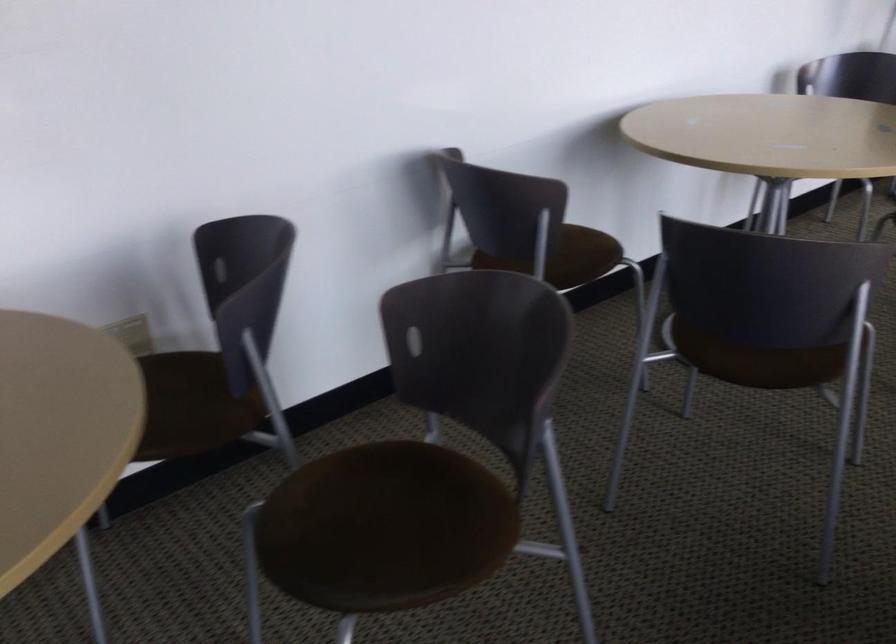
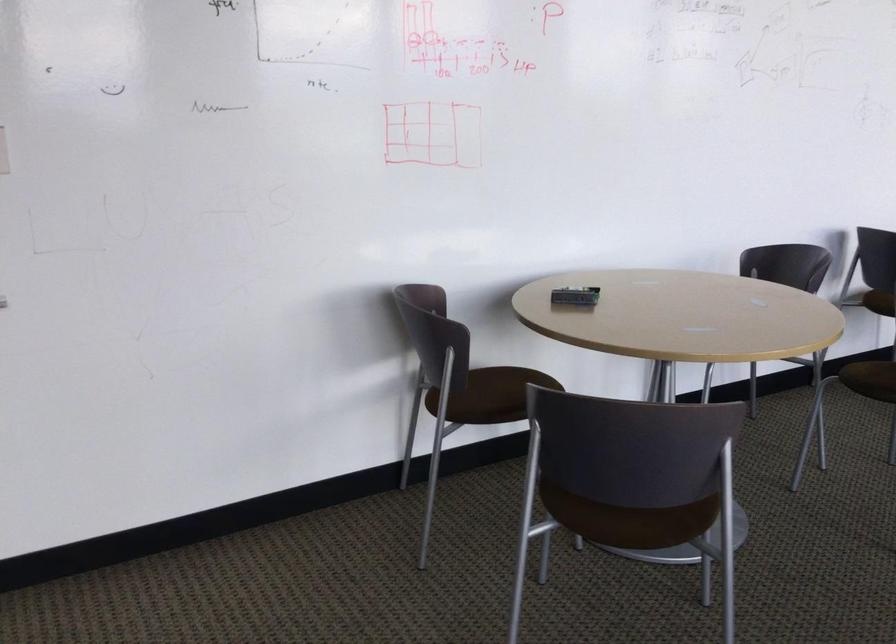
In the second image, find the point that corresponds to (x=297, y=523) in the first image.

(872, 379)